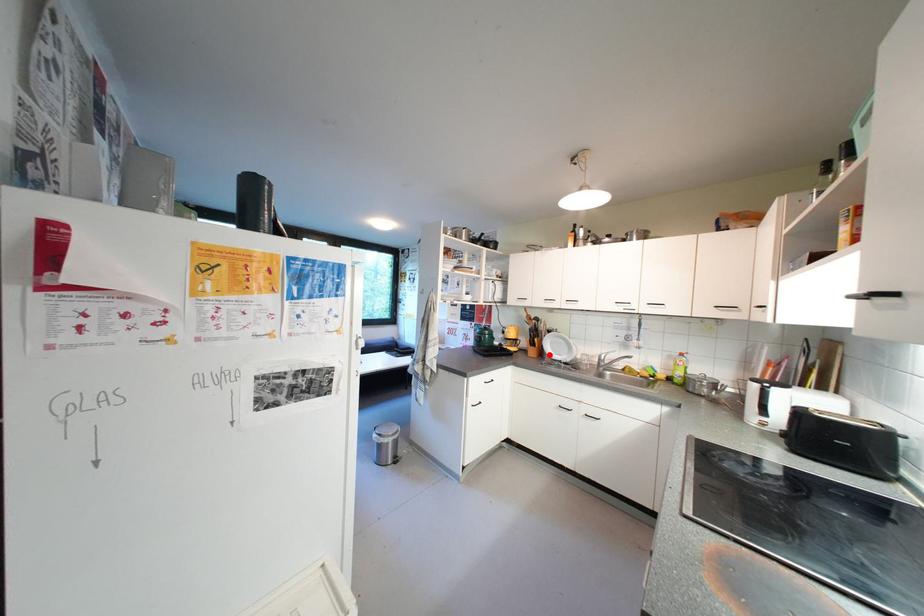
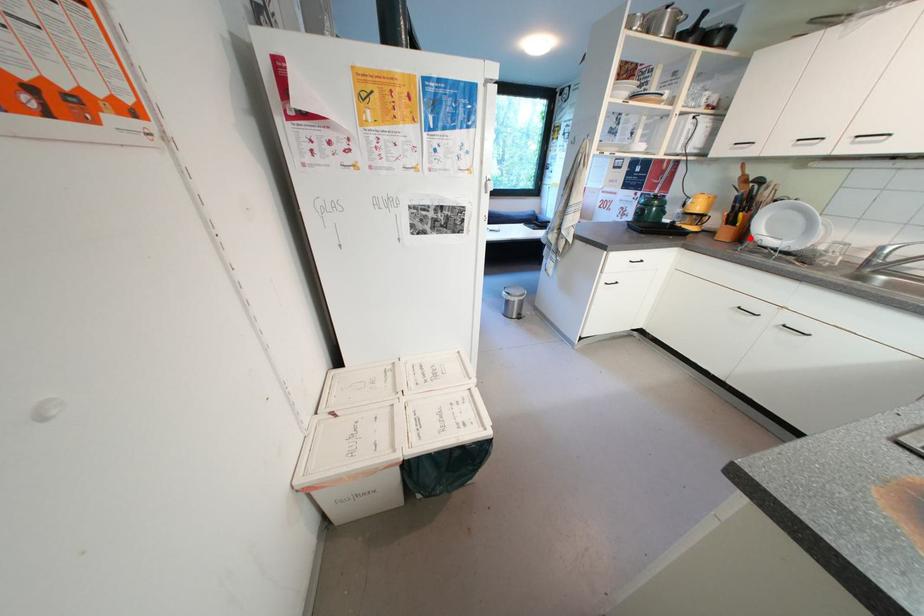
I am providing you with two images of the same scene from different viewpoints. A red point is marked on the first image and another point is marked on the second image. Does the point marked in image1 correspond to the same location as the one in image2?

Yes